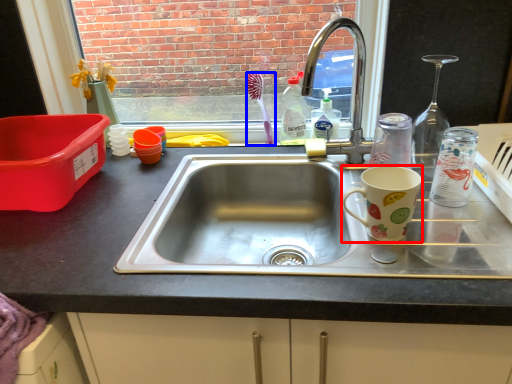
Question: Among these objects, which one is nearest to the camera, coffee cup (highlighted by a red box) or toothbrush (highlighted by a blue box)?

Choices:
 (A) coffee cup
 (B) toothbrush

Answer: (A)